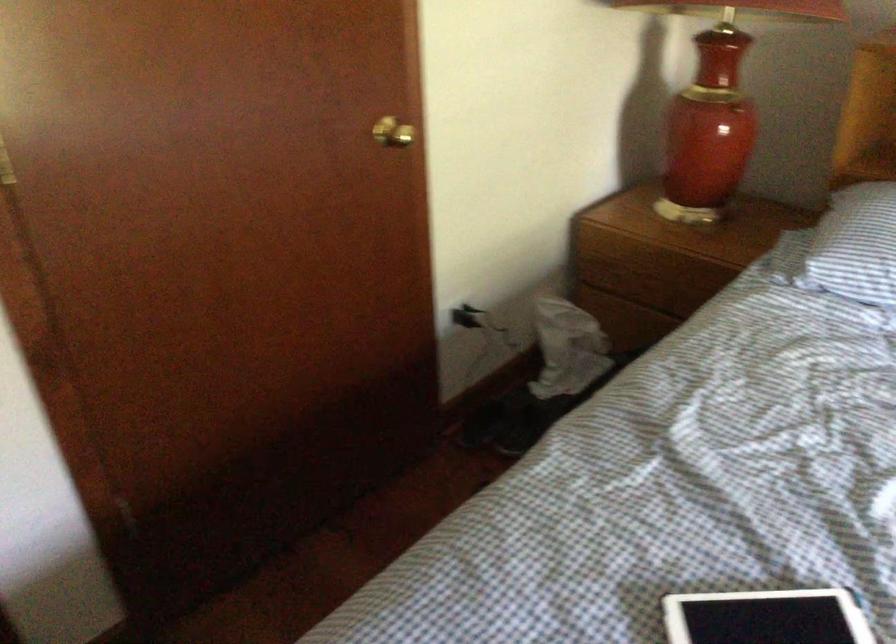
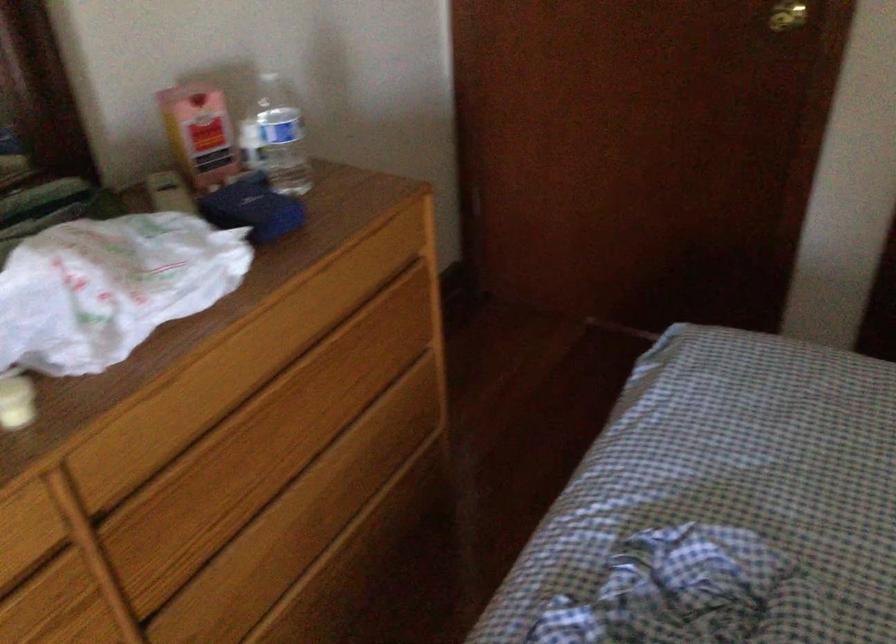
Based on the continuous images, in which direction is the camera rotating?

The camera's rotation is toward left-down.